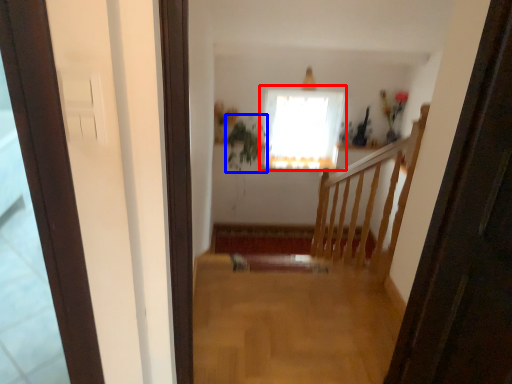
Question: Which of the following is the closest to the observer, window (highlighted by a red box) or plant (highlighted by a blue box)?

Choices:
 (A) window
 (B) plant

Answer: (B)